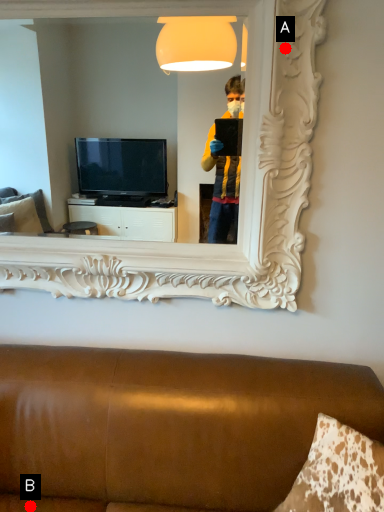
Question: Two points are circled on the image, labeled by A and B beside each circle. Which point is farther from the camera taking this photo?

Choices:
 (A) A is further
 (B) B is further

Answer: (A)